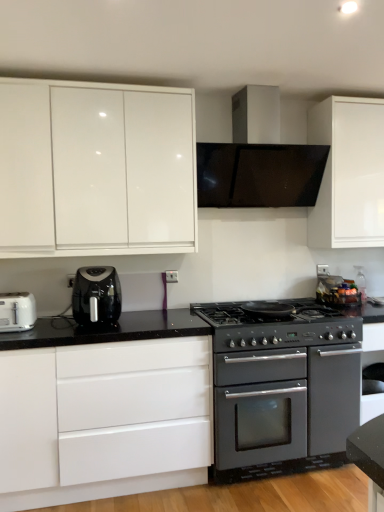
Image resolution: width=384 pixels, height=512 pixels. I want to click on matte black oven at center, so click(290, 416).

The height and width of the screenshot is (512, 384). Describe the element at coordinates (251, 165) in the screenshot. I see `satin silver range hood at upper center` at that location.

This screenshot has width=384, height=512. What do you see at coordinates (17, 311) in the screenshot? I see `white plastic toaster at left` at bounding box center [17, 311].

What is the approximate height of black matte gas stove at center?

black matte gas stove at center is 6.85 inches in height.

Identify the location of white glossy cabinet at lower left, the 1th cabinetry from the bottom. (104, 420).

At what (x,y) coordinates should I click in order to perform the action: click on matte black oven at center. Please return your answer as a coordinate pair (x, y). Looking at the image, I should click on (290, 416).

Between white glossy cabinet at lower left, the 1th cabinetry from the bottom, and white plastic toaster at left, which one has more height?

white glossy cabinet at lower left, the 1th cabinetry from the bottom, is taller.

Which point is more distant from viewer, (66,354) or (18,298)?

The point (18,298) is farther.

Is white glossy cabinet at lower left, positioned as the second cabinetry in top-to-bottom order, bigger than white plastic toaster at left?

Yes.

From the image's perspective, is white glossy cabinet at lower left, positioned as the second cabinetry in top-to-bottom order, above or below white plastic toaster at left?

From the image's perspective, white glossy cabinet at lower left, positioned as the second cabinetry in top-to-bottom order, appears below white plastic toaster at left.

From the image's perspective, is white glossy cabinet at lower left, the 1th cabinetry from the bottom, positioned above or below black plastic air fryer at left?

From the image's perspective, white glossy cabinet at lower left, the 1th cabinetry from the bottom, appears below black plastic air fryer at left.

Is white glossy cabinet at lower left, positioned as the second cabinetry in top-to-bottom order, bigger than black plastic air fryer at left?

Indeed, white glossy cabinet at lower left, positioned as the second cabinetry in top-to-bottom order, has a larger size compared to black plastic air fryer at left.

Does point (27, 390) come farther from viewer compared to point (78, 310)?

No.

Considering the relative positions of white glossy cabinet at lower left, positioned as the second cabinetry in top-to-bottom order, and black plastic air fryer at left in the image provided, is white glossy cabinet at lower left, positioned as the second cabinetry in top-to-bottom order, to the left of black plastic air fryer at left from the viewer's perspective?

Incorrect, white glossy cabinet at lower left, positioned as the second cabinetry in top-to-bottom order, is not on the left side of black plastic air fryer at left.

Is glossy white cabinet at upper left, which is the first cabinetry in top-to-bottom order, to the right of white plastic toaster at left from the viewer's perspective?

Yes.

Find the location of a particular element. The width and height of the screenshot is (384, 512). the 1st cabinetry to the right when counting from the white plastic toaster at left is located at coordinates (96, 169).

From a real-world perspective, is glossy white cabinet at upper left, which is the first cabinetry in top-to-bottom order, physically above white plastic toaster at left?

Yes.

What's the angular difference between black plastic air fryer at left and black matte gas stove at center's facing directions?

The facing directions of black plastic air fryer at left and black matte gas stove at center are 1.14 degrees apart.

Who is taller, black plastic air fryer at left or black matte gas stove at center?

black plastic air fryer at left is taller.

Is black plastic air fryer at left next to black matte gas stove at center?

No.

From the picture: Is black plastic air fryer at left thinner than white glossy cabinet at lower left, positioned as the second cabinetry in top-to-bottom order?

Correct, the width of black plastic air fryer at left is less than that of white glossy cabinet at lower left, positioned as the second cabinetry in top-to-bottom order.

The image size is (384, 512). What are the coordinates of `cabinetry lying on the right of black plastic air fryer at left` in the screenshot? It's located at (104, 420).

Is black plastic air fryer at left inside or outside of white glossy cabinet at lower left, positioned as the second cabinetry in top-to-bottom order?

black plastic air fryer at left is not enclosed by white glossy cabinet at lower left, positioned as the second cabinetry in top-to-bottom order.

In terms of height, does black matte gas stove at center look taller or shorter compared to glossy white cabinet at upper left, positioned as the 2th cabinetry in bottom-to-top order?

Considering their sizes, black matte gas stove at center has less height than glossy white cabinet at upper left, positioned as the 2th cabinetry in bottom-to-top order.

Which point is more forward, (x=349, y=323) or (x=17, y=250)?

The point (x=17, y=250) is more forward.

Find the location of a particular element. The height and width of the screenshot is (512, 384). the 2nd cabinetry counting from the left of the black matte gas stove at center is located at coordinates (96, 169).

Could you tell me if black matte gas stove at center is facing glossy white cabinet at upper left, positioned as the 2th cabinetry in bottom-to-top order?

No, black matte gas stove at center is not turned towards glossy white cabinet at upper left, positioned as the 2th cabinetry in bottom-to-top order.

Consider the image. Between white glossy cabinet at lower left, positioned as the second cabinetry in top-to-bottom order, and satin silver range hood at upper center, which one has smaller width?

satin silver range hood at upper center is thinner.

Consider the image. Which is correct: white glossy cabinet at lower left, the 1th cabinetry from the bottom, is inside satin silver range hood at upper center, or outside of it?

The correct answer is: outside.

At what (x,y) coordinates should I click in order to perform the action: click on cabinetry located underneath the white plastic toaster at left (from a real-world perspective). Please return your answer as a coordinate pair (x, y). The width and height of the screenshot is (384, 512). Looking at the image, I should click on (104, 420).

Locate an element on the screen. The image size is (384, 512). kitchen appliance to the left of white glossy cabinet at lower left, positioned as the second cabinetry in top-to-bottom order is located at coordinates (96, 295).

When comparing their distances from white plastic toaster at left, does satin silver range hood at upper center or black plastic air fryer at left seem closer?

Based on the image, black plastic air fryer at left appears to be nearer to white plastic toaster at left.

Considering their positions, is satin silver range hood at upper center positioned closer to glossy white cabinet at upper left, which is the first cabinetry in top-to-bottom order, than white plastic toaster at left?

Based on the image, satin silver range hood at upper center appears to be nearer to glossy white cabinet at upper left, which is the first cabinetry in top-to-bottom order.

Estimate the real-world distances between objects in this image. Which object is closer to black plastic air fryer at left, glossy white cabinet at upper left, which is the first cabinetry in top-to-bottom order, or white plastic toaster at left?

white plastic toaster at left lies closer to black plastic air fryer at left than the other object.

Estimate the real-world distances between objects in this image. Which object is further from white glossy cabinet at lower left, the 1th cabinetry from the bottom, glossy white cabinet at upper left, positioned as the 2th cabinetry in bottom-to-top order, or black plastic air fryer at left?

The object further to white glossy cabinet at lower left, the 1th cabinetry from the bottom, is glossy white cabinet at upper left, positioned as the 2th cabinetry in bottom-to-top order.

Looking at the image, which one is located closer to white plastic toaster at left, satin silver range hood at upper center or black matte gas stove at center?

black matte gas stove at center.

Based on their spatial positions, is black plastic air fryer at left or satin silver range hood at upper center further from white glossy cabinet at lower left, the 1th cabinetry from the bottom?

satin silver range hood at upper center lies further to white glossy cabinet at lower left, the 1th cabinetry from the bottom, than the other object.

Which object lies further to the anchor point matte black oven at center, white glossy cabinet at lower left, the 1th cabinetry from the bottom, or black matte gas stove at center?

white glossy cabinet at lower left, the 1th cabinetry from the bottom, lies further to matte black oven at center than the other object.

From the image, which object appears to be farther from satin silver range hood at upper center, glossy white cabinet at upper left, positioned as the 2th cabinetry in bottom-to-top order, or matte black oven at center?

matte black oven at center is further to satin silver range hood at upper center.

Image resolution: width=384 pixels, height=512 pixels. I want to click on gas stove between glossy white cabinet at upper left, positioned as the 2th cabinetry in bottom-to-top order, and matte black oven at center from top to bottom, so click(x=277, y=325).

The image size is (384, 512). What are the coordinates of `kitchen appliance that lies between glossy white cabinet at upper left, which is the first cabinetry in top-to-bottom order, and white plastic toaster at left from top to bottom` in the screenshot? It's located at (96, 295).

The height and width of the screenshot is (512, 384). I want to click on kitchen appliance situated between white plastic toaster at left and matte black oven at center from left to right, so click(x=96, y=295).

This screenshot has width=384, height=512. I want to click on kitchen appliance situated between white plastic toaster at left and satin silver range hood at upper center from left to right, so click(96, 295).